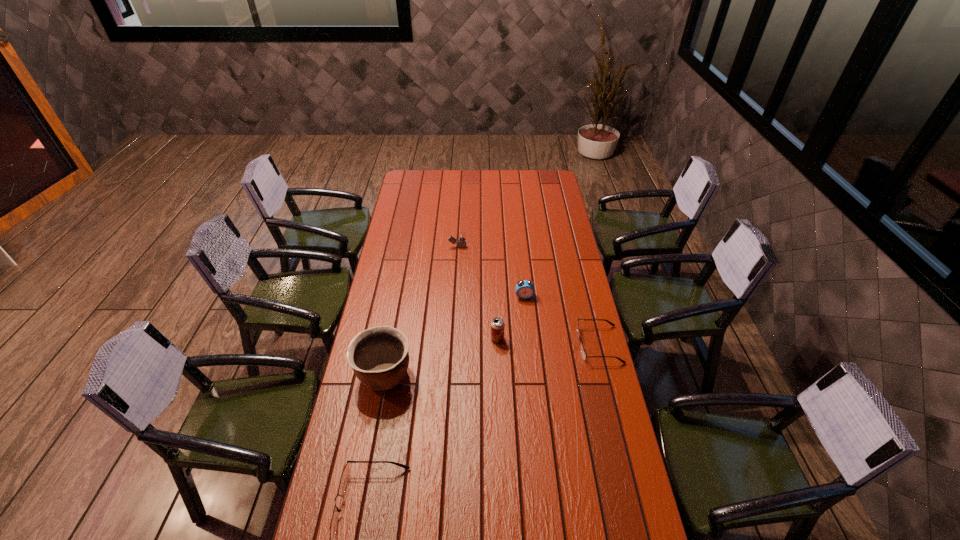
Locate an element on the screen. The width and height of the screenshot is (960, 540). object that stands as the third closest to the tallest object is located at coordinates (525, 289).

Identify which object is the closest to the tallest object. Please provide its 2D coordinates. Your answer should be formatted as a tuple, i.e. [(x, y)], where the tuple contains the x and y coordinates of a point satisfying the conditions above.

[(345, 474)]